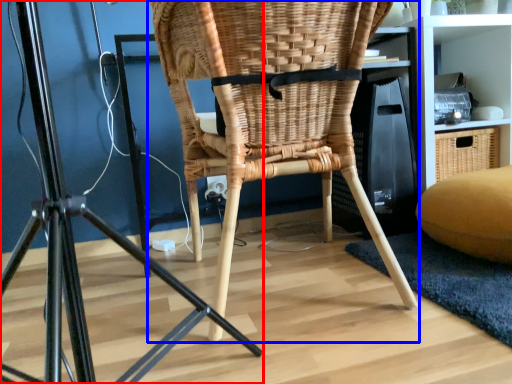
Question: Which of the following is the closest to the observer, furniture (highlighted by a red box) or chair (highlighted by a blue box)?

Choices:
 (A) furniture
 (B) chair

Answer: (A)